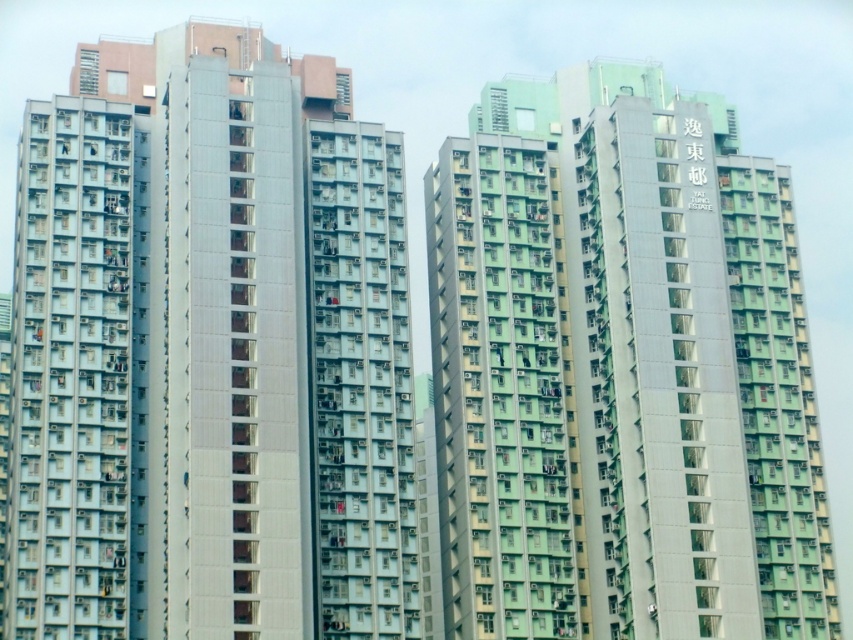
Question: Observing the image, what is the correct spatial positioning of white glossy building at center in reference to green matte building at center?

Choices:
 (A) right
 (B) left

Answer: (B)

Question: Where is white glossy building at center located in relation to green matte building at center in the image?

Choices:
 (A) above
 (B) below

Answer: (B)

Question: Among these objects, which one is nearest to the camera?

Choices:
 (A) green matte building at center
 (B) white glossy building at center

Answer: (B)

Question: Which of the following is the farthest from the observer?

Choices:
 (A) green matte building at center
 (B) white glossy building at center

Answer: (A)

Question: Does white glossy building at center have a greater width compared to green matte building at center?

Choices:
 (A) yes
 (B) no

Answer: (B)

Question: Which of the following is the farthest from the observer?

Choices:
 (A) white glossy building at center
 (B) green matte building at center

Answer: (B)